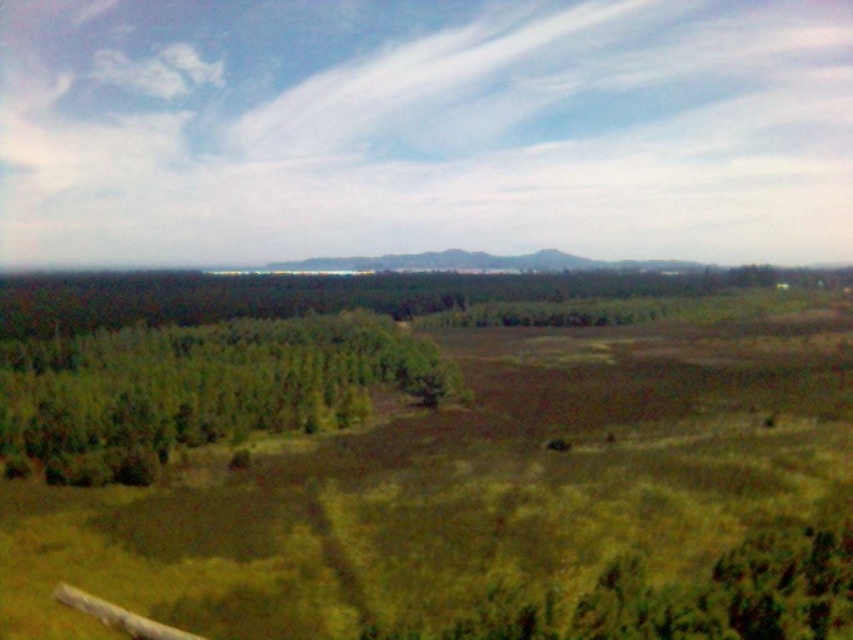
Question: Is green grassy field at center positioned in front of green leafy trees at left?

Choices:
 (A) yes
 (B) no

Answer: (A)

Question: Is green grassy field at center wider than green leafy trees at left?

Choices:
 (A) yes
 (B) no

Answer: (A)

Question: Can you confirm if green grassy field at center is smaller than green leafy trees at left?

Choices:
 (A) no
 (B) yes

Answer: (A)